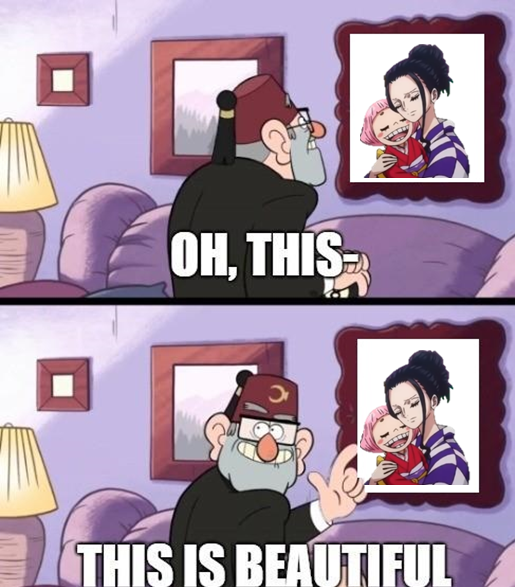
This screenshot has width=515, height=587. Identify the location of blue background, wall. pyautogui.click(x=62, y=33).